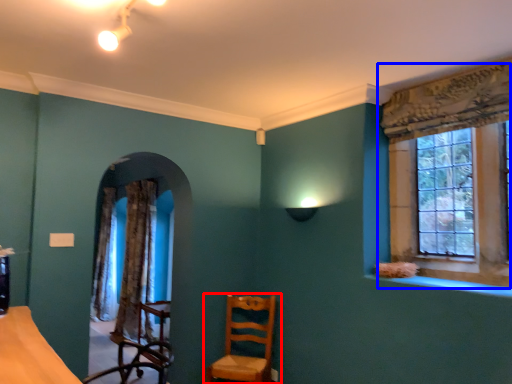
Question: Among these objects, which one is farthest to the camera, chair (highlighted by a red box) or window (highlighted by a blue box)?

Choices:
 (A) chair
 (B) window

Answer: (A)